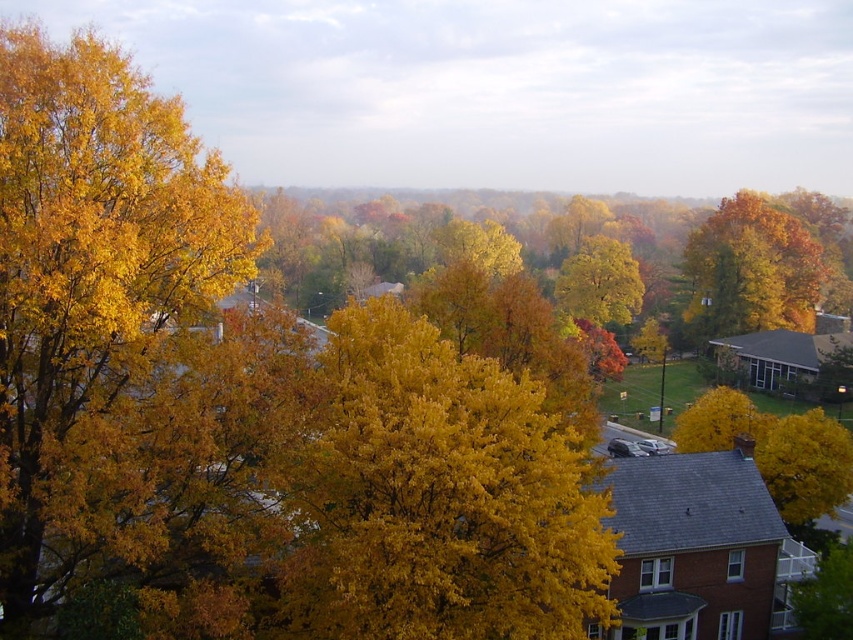
Between golden yellow leaves at left and golden yellow leaves at center, which one is positioned lower?

golden yellow leaves at left

Between golden yellow leaves at left and golden yellow leaves at center, which one has more height?

With more height is golden yellow leaves at left.

Who is more forward, (78, 314) or (569, 312)?

Point (78, 314)

Image resolution: width=853 pixels, height=640 pixels. I want to click on golden yellow leaves at left, so click(x=126, y=346).

From the picture: Between golden yellow leaves at left and yellow leafy tree at center, which one has more height?

With more height is golden yellow leaves at left.

What do you see at coordinates (126, 346) in the screenshot? I see `golden yellow leaves at left` at bounding box center [126, 346].

Find the location of a particular element. This screenshot has height=640, width=853. golden yellow leaves at left is located at coordinates (126, 346).

Consider the image. Does golden yellow leaves at upper right have a greater width compared to golden yellow leaves at center?

Indeed, golden yellow leaves at upper right has a greater width compared to golden yellow leaves at center.

Is golden yellow leaves at upper right taller than golden yellow leaves at center?

Yes, golden yellow leaves at upper right is taller than golden yellow leaves at center.

Is point (787, 221) positioned behind point (624, 282)?

That is True.

This screenshot has width=853, height=640. Identify the location of golden yellow leaves at upper right. (750, 269).